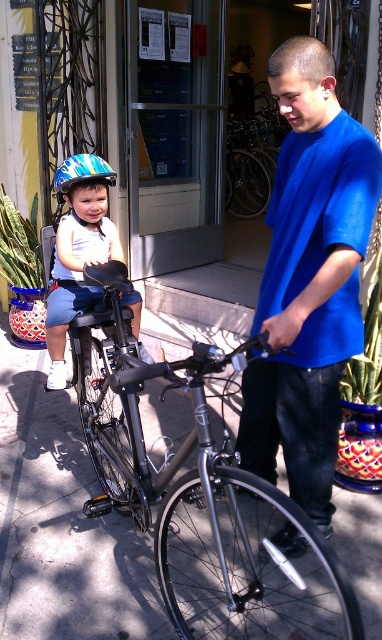
Looking at this image, you are a photographer taking a picture of the blue matte shirt at center and the matte blue helmet at left. Which object will appear larger in the photo?

The blue matte shirt at center will appear larger in the photo because it is closer to the viewer than the matte blue helmet at left.

You are a photographer setting up a shot of the scene. You need to ensure that the blue matte shirt at center and the blue and green striped bicycle helmet at left are both in focus. Given that your camera can only focus on objects within a 30 cm width range, will both objects fit within this range?

The blue matte shirt at center is wider than the blue and green striped bicycle helmet at left. Since the camera can focus on objects within a 30 cm width range, and the difference in their widths is not specified, it is possible that both objects can fit within the focus range. However, without exact measurements, we cannot be certain.